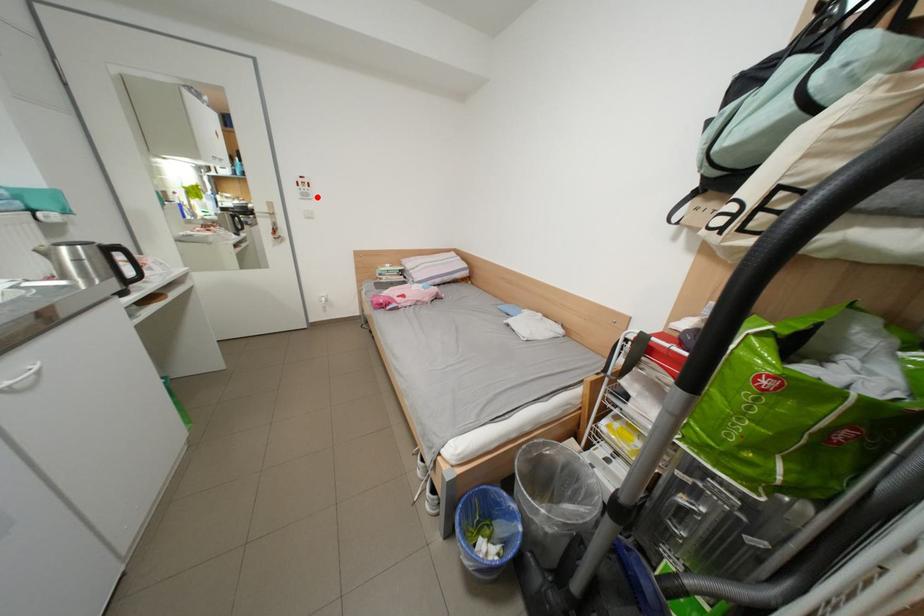
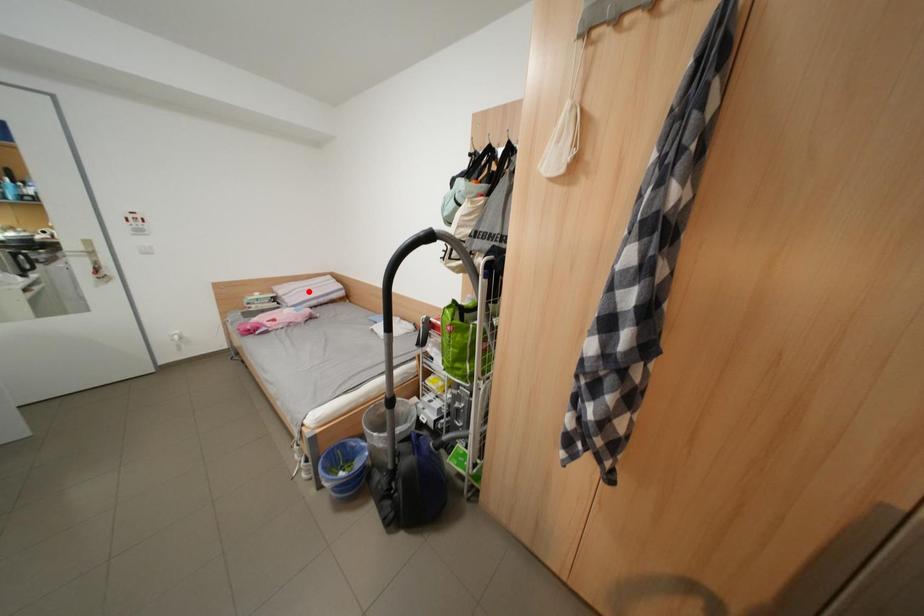
I am providing you with two images of the same scene from different viewpoints. A red point is marked on the first image and another point is marked on the second image. Is the red point in image1 aligned with the point shown in image2?

No